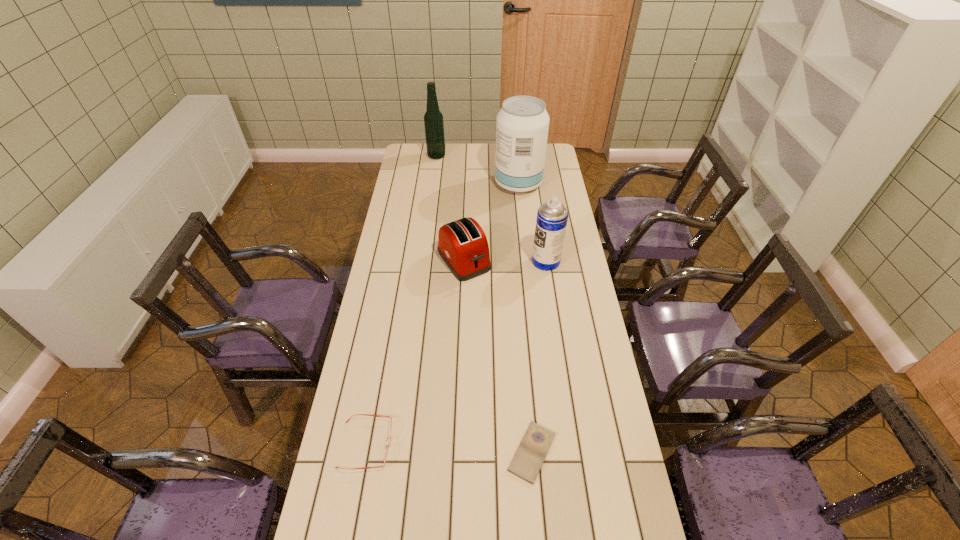
This screenshot has width=960, height=540. I want to click on vacant space located on the front of the farthest object, so click(433, 187).

You are a GUI agent. You are given a task and a screenshot of the screen. Output one action in this format:
    pyautogui.click(x=<x>, y=<y>)
    Task: Click on the vacant position located on the label side of the aerosol can
    The height and width of the screenshot is (540, 960).
    Given the screenshot: What is the action you would take?
    pyautogui.click(x=442, y=261)

In order to click on free space located on the label side of the aerosol can in this screenshot , I will do `click(482, 261)`.

Locate an element on the screen. This screenshot has width=960, height=540. vacant space located 0.250m on the label side of the aerosol can is located at coordinates (469, 261).

At what (x,y) coordinates should I click in order to perform the action: click on vacant area situated on the back of the toaster. Please return your answer as a coordinate pair (x, y). Looking at the image, I should click on pyautogui.click(x=466, y=213).

Find the location of a particular element. The height and width of the screenshot is (540, 960). blank area located on the lenses of the spectacles is located at coordinates (474, 444).

Locate an element on the screen. vacant space located on the left of the diary is located at coordinates (481, 452).

Identify the location of object located at the far edge. (433, 119).

Image resolution: width=960 pixels, height=540 pixels. Identify the location of alcohol that is at the left edge. (433, 119).

The height and width of the screenshot is (540, 960). Identify the location of spectacles at the left edge. (386, 446).